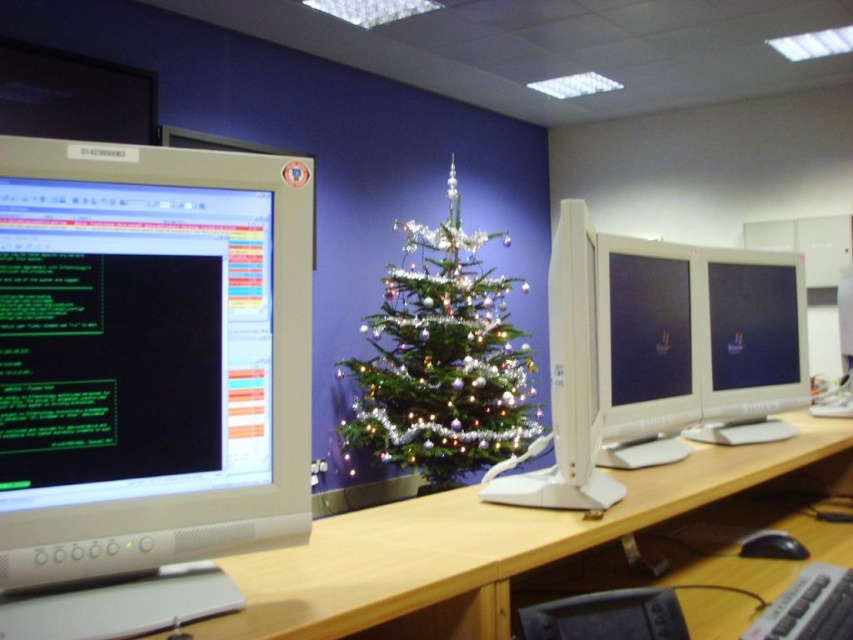
You are organizing a desk and need to place both the black plastic keyboard at lower right and the black rubber mouse at lower right side by side. Which one requires more horizontal space?

The black plastic keyboard at lower right requires more horizontal space because its width is larger than the black rubber mouse at lower right.

You are standing in the office and want to reach the point marked as point [840,586]. If your height is 1.7 meters, will you be able to see the top of the Christmas tree from that point?

The point [840,586] is 1.26 meters away from you. Since the Christmas tree is in the background and the ceiling has a grid pattern, it is possible that the tree is tall enough for you to see its top from that distance. However, without knowing the exact height of the tree, it is difficult to determine for sure. But given the festive decoration and typical office setup, it is likely that the tree is within your line of sight.